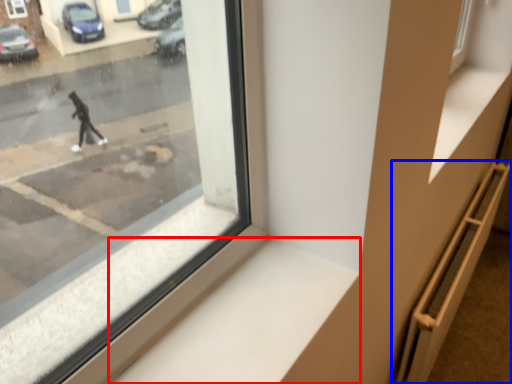
Question: Which of the following is the closest to the observer, window sill (highlighted by a red box) or stairwell (highlighted by a blue box)?

Choices:
 (A) window sill
 (B) stairwell

Answer: (A)